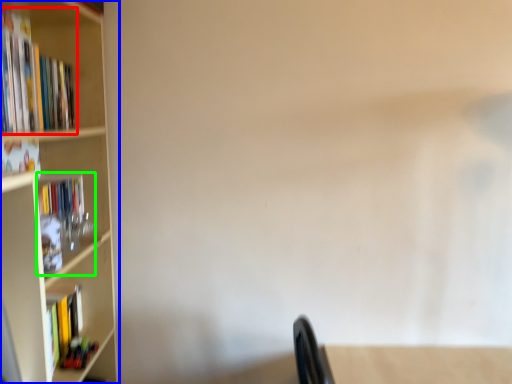
Question: Based on their relative distances, which object is farther from book (highlighted by a red box)? Choose from bookcase (highlighted by a blue box) and book (highlighted by a green box).

Choices:
 (A) bookcase
 (B) book

Answer: (B)